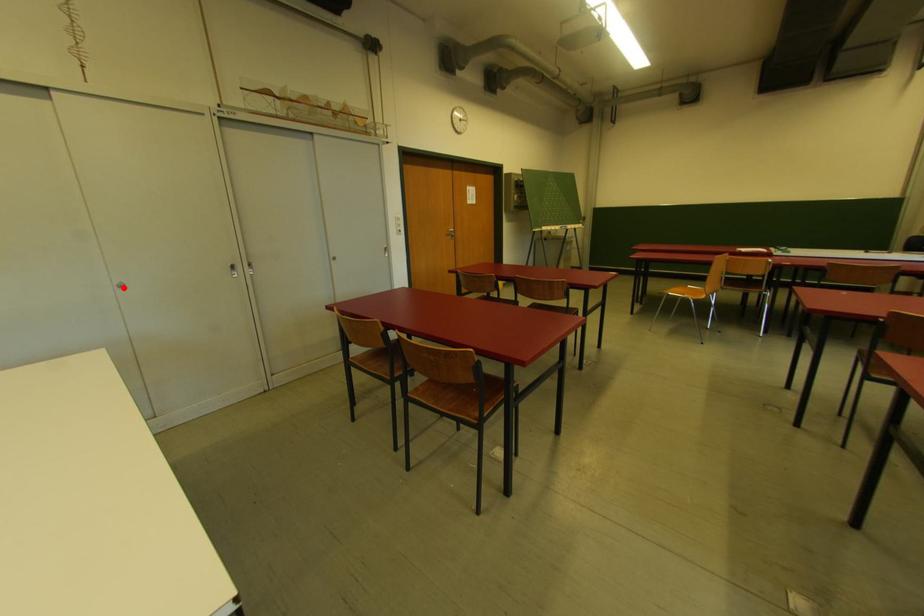
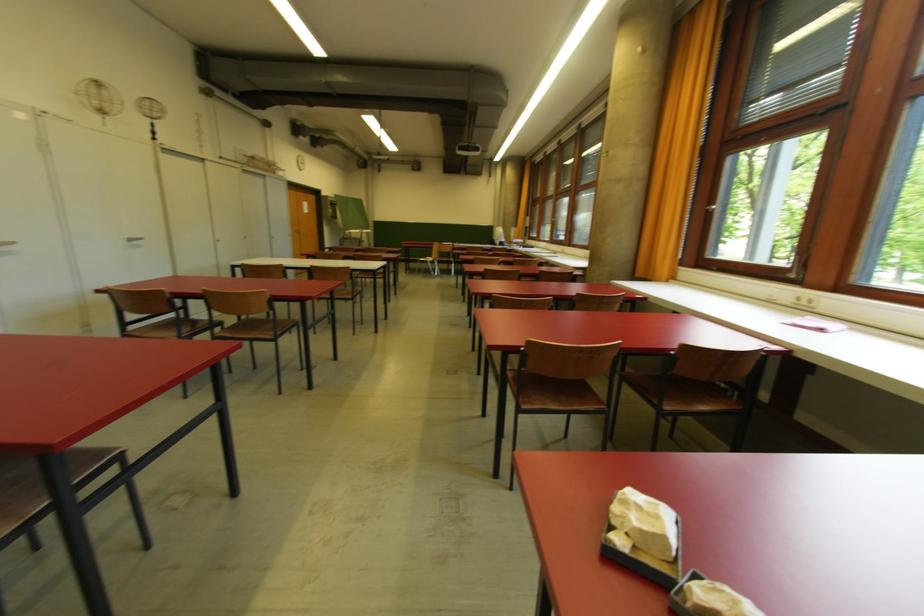
Question: I am providing you with two images of the same scene from different viewpoints. In image1, a red point is highlighted. Considering the same 3D point in image2, which of the following is correct?

Choices:
 (A) It is closer
 (B) It is farther

Answer: (A)